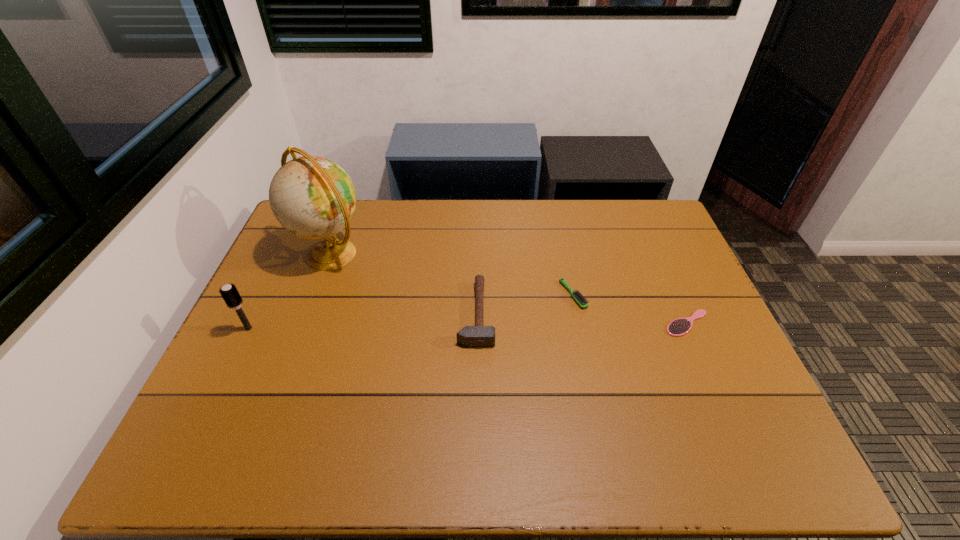
Where is `globe`? globe is located at coordinates (312, 197).

You are a GUI agent. You are given a task and a screenshot of the screen. Output one action in this format:
    pyautogui.click(x=<x>, y=<y>)
    Task: Click on the second object from left to right
    The width and height of the screenshot is (960, 540).
    Given the screenshot: What is the action you would take?
    pyautogui.click(x=312, y=197)

Where is `the leftmost object`? the leftmost object is located at coordinates (229, 292).

You are a GUI agent. You are given a task and a screenshot of the screen. Output one action in this format:
    pyautogui.click(x=<x>, y=<y>)
    Task: Click on the leftmost hairbrush
    This screenshot has height=540, width=960.
    Given the screenshot: What is the action you would take?
    pyautogui.click(x=229, y=292)

Find the location of a particular element. This screenshot has width=960, height=540. hammer is located at coordinates (470, 336).

What are the coordinates of `the third object from right to left` in the screenshot? It's located at click(x=470, y=336).

I want to click on the second tallest hairbrush, so click(581, 301).

You are a GUI agent. You are given a task and a screenshot of the screen. Output one action in this format:
    pyautogui.click(x=<x>, y=<y>)
    Task: Click on the second object from right to left
    
    Given the screenshot: What is the action you would take?
    pyautogui.click(x=581, y=301)

Locate an element on the screen. the rightmost object is located at coordinates (681, 326).

This screenshot has width=960, height=540. I want to click on the shortest hairbrush, so click(x=681, y=326).